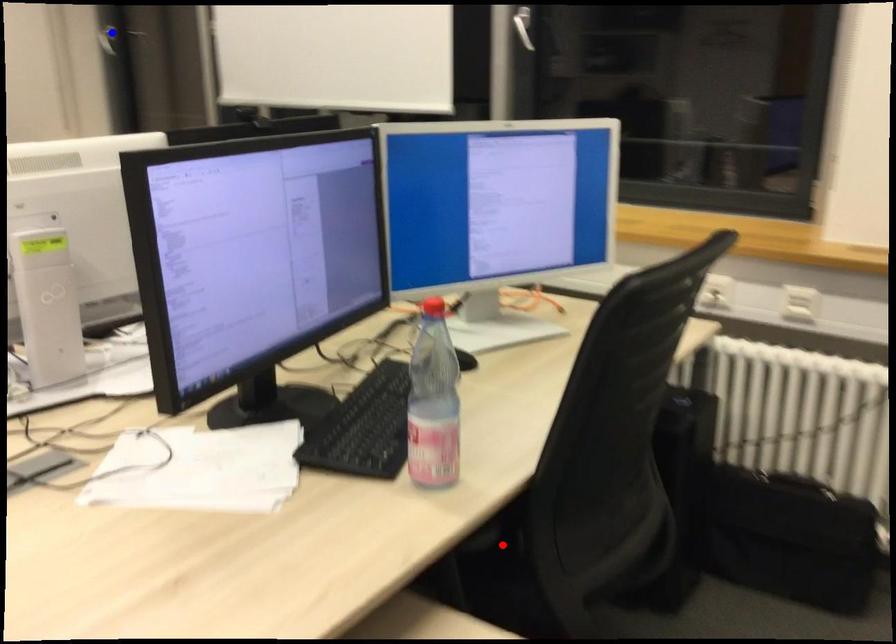
Question: In the image, two points are highlighted. Which point is nearer to the camera? Reply with the corresponding letter.

Choices:
 (A) blue point
 (B) red point

Answer: (B)